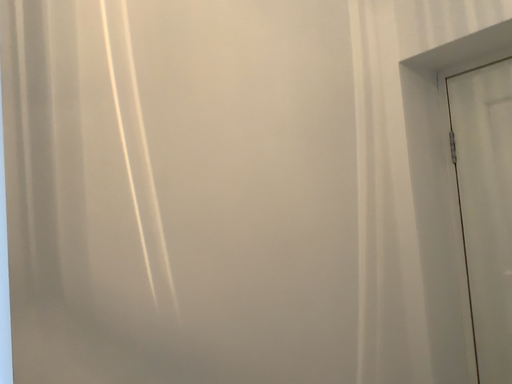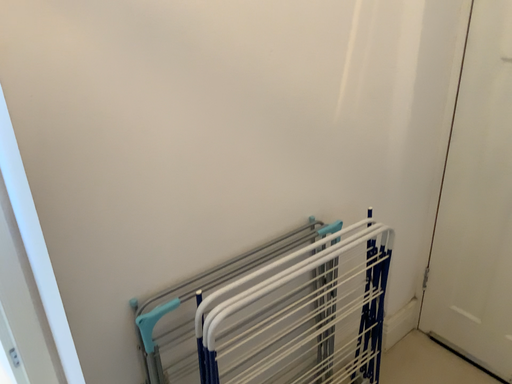
Question: Which way did the camera rotate in the video?

Choices:
 (A) rotated downward
 (B) rotated upward

Answer: (A)